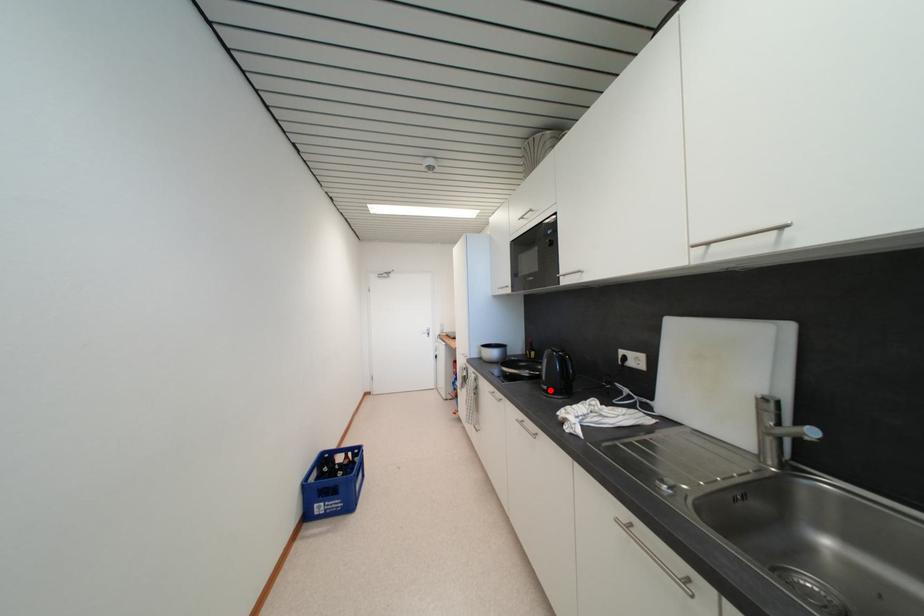
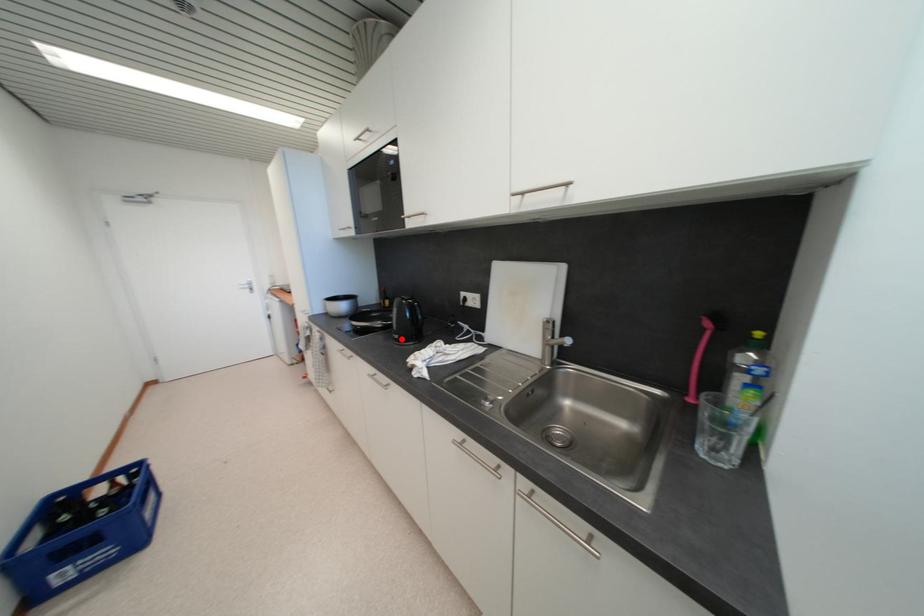
I am providing you with two images of the same scene from different viewpoints. A red point is marked on the first image and another point is marked on the second image. Are the points marked in image1 and image2 representing the same 3D position?

Yes